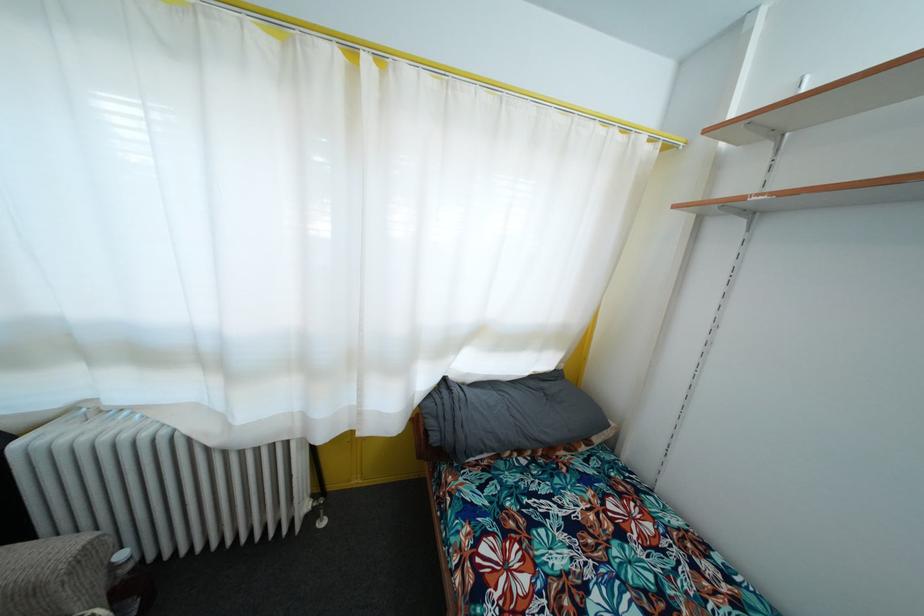
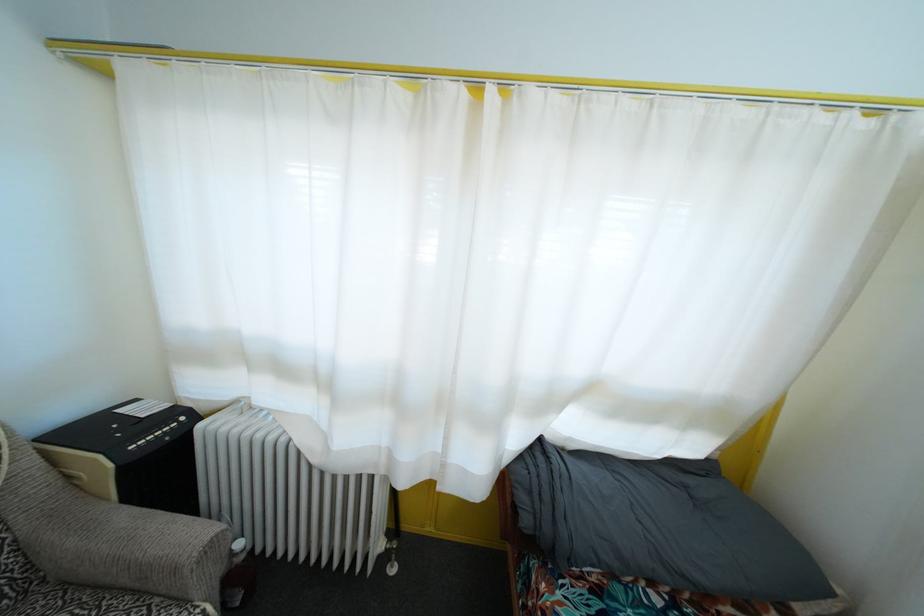
Question: The camera is either moving clockwise (left) or counter-clockwise (right) around the object. The first image is from the beginning of the video and the second image is from the end. Is the camera moving left or right when shooting the video?

Choices:
 (A) Left
 (B) Right

Answer: (B)